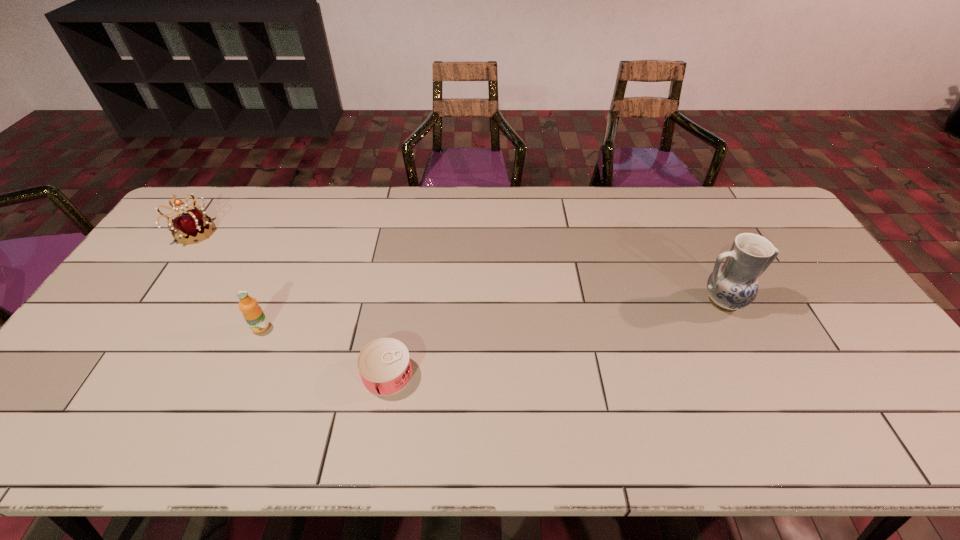
Locate an element on the screen. vacant area between the second nearest object and the second object from right to left is located at coordinates (324, 351).

This screenshot has height=540, width=960. Identify the location of object that stands as the third closest to the second object from right to left. (732, 286).

Choose which object is the second nearest neighbor to the leftmost object. Please provide its 2D coordinates. Your answer should be formatted as a tuple, i.e. [(x, y)], where the tuple contains the x and y coordinates of a point satisfying the conditions above.

[(384, 365)]

The height and width of the screenshot is (540, 960). In order to click on vacant area that satisfies the following two spatial constraints: 1. on the label of the orange juice; 2. on the left side of the can in this screenshot , I will do `click(241, 374)`.

The width and height of the screenshot is (960, 540). What are the coordinates of `free space that satisfies the following two spatial constraints: 1. on the back side of the third object from left to right; 2. on the left side of the rightmost object` in the screenshot? It's located at (399, 302).

Identify the location of free space that satisfies the following two spatial constraints: 1. on the front-facing side of the second farthest object; 2. on the right side of the tiara. (145, 302).

This screenshot has height=540, width=960. In order to click on blank area in the image that satisfies the following two spatial constraints: 1. on the back side of the can; 2. on the front-facing side of the farthest object in this screenshot , I will do pos(411,233).

The height and width of the screenshot is (540, 960). I want to click on vacant space that satisfies the following two spatial constraints: 1. on the front-facing side of the leftmost object; 2. on the left side of the can, so click(x=95, y=374).

This screenshot has height=540, width=960. Find the location of `vacant space that satisfies the following two spatial constraints: 1. on the front-facing side of the nearest object; 2. on the left side of the tiara`. vacant space that satisfies the following two spatial constraints: 1. on the front-facing side of the nearest object; 2. on the left side of the tiara is located at coordinates (95, 374).